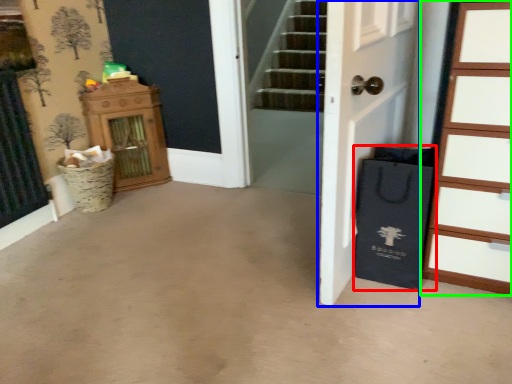
Question: Which is nearer to the shopping bag (highlighted by a red box)? door (highlighted by a blue box) or chest of drawers (highlighted by a green box).

Choices:
 (A) door
 (B) chest of drawers

Answer: (B)